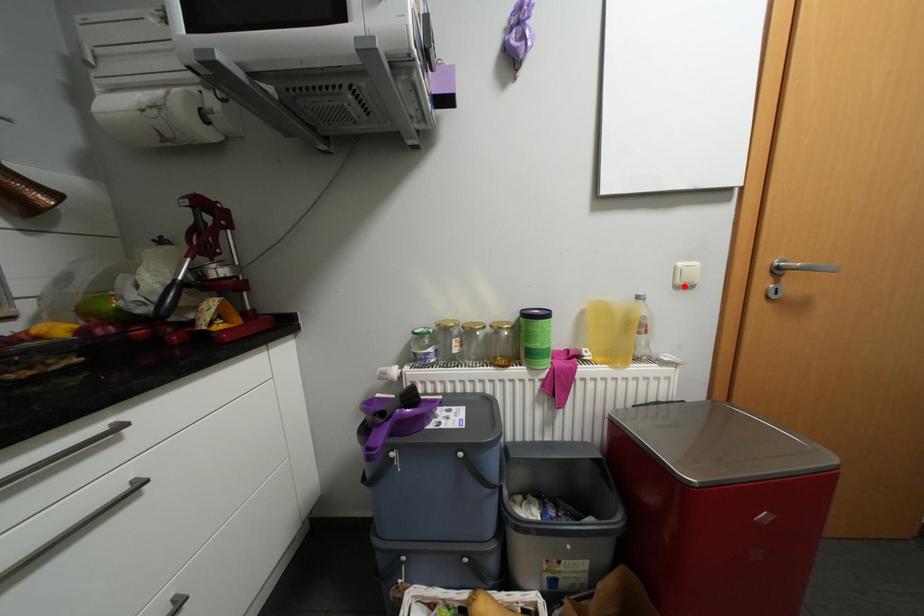
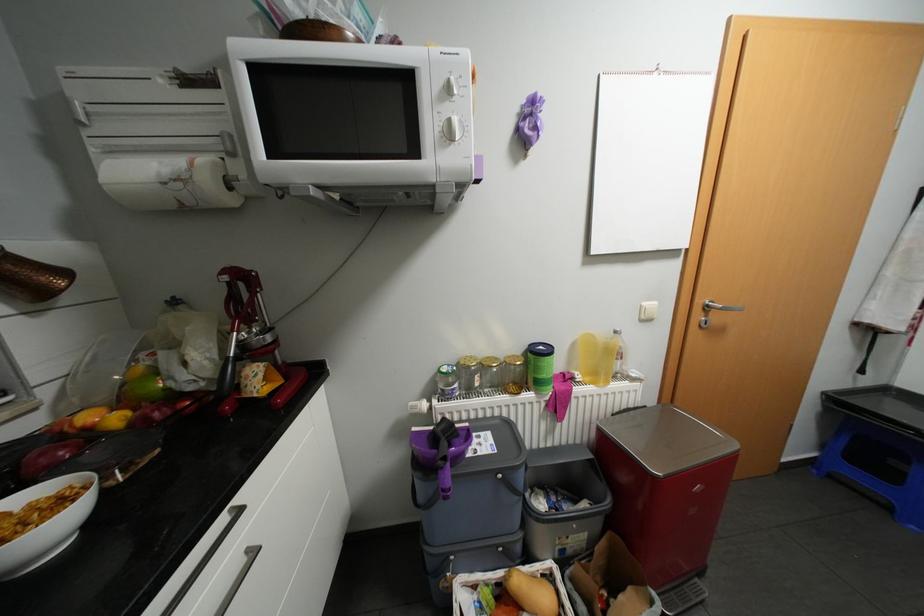
Question: I am providing you with two images of the same scene from different viewpoints. A red point is marked on the first image. Is the red point's position out of view in image 2?

Choices:
 (A) Yes
 (B) No

Answer: (B)